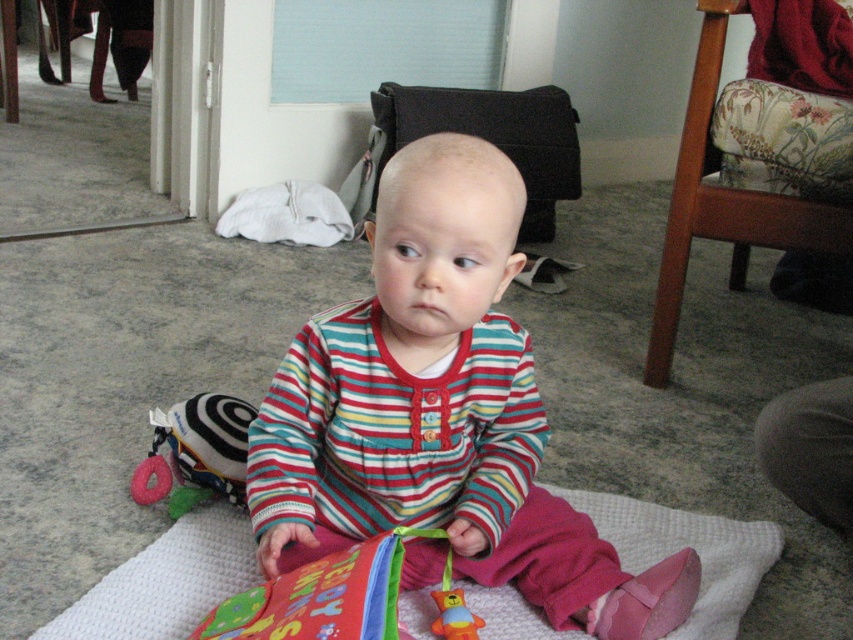
Question: Is striped fabric baby at center bigger than soft plush toy at lower left?

Choices:
 (A) yes
 (B) no

Answer: (A)

Question: Which of these objects is positioned closest to the soft plush toy at lower left?

Choices:
 (A) striped fabric baby at center
 (B) rubber duck toy at center

Answer: (A)

Question: Which point is closer to the camera taking this photo?

Choices:
 (A) (213, 452)
 (B) (608, 554)

Answer: (B)

Question: Among these points, which one is nearest to the camera?

Choices:
 (A) (238, 448)
 (B) (585, 538)
 (C) (438, 618)

Answer: (C)

Question: Can you confirm if striped fabric baby at center is positioned below rubber duck toy at center?

Choices:
 (A) no
 (B) yes

Answer: (A)

Question: Does soft plush toy at lower left lie in front of rubber duck toy at center?

Choices:
 (A) no
 (B) yes

Answer: (A)